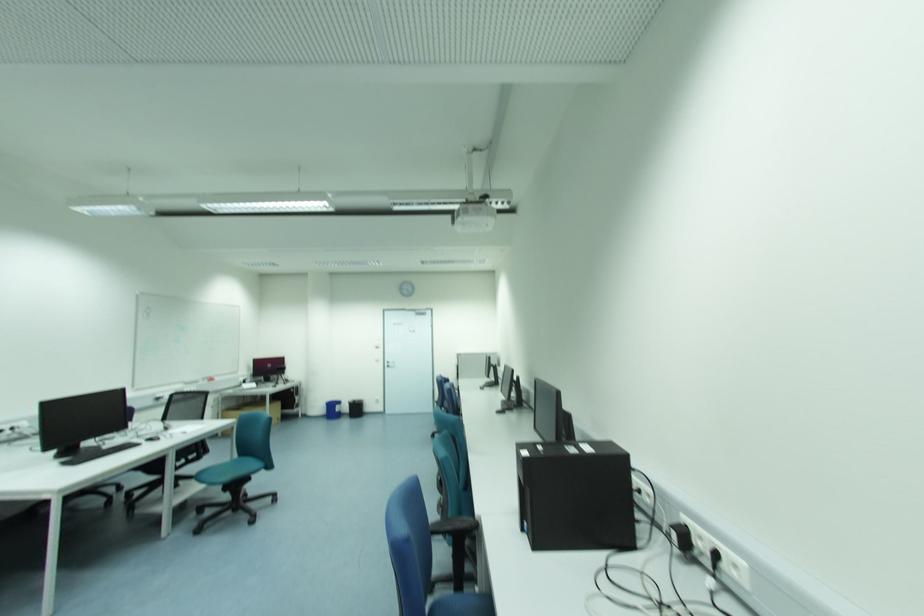
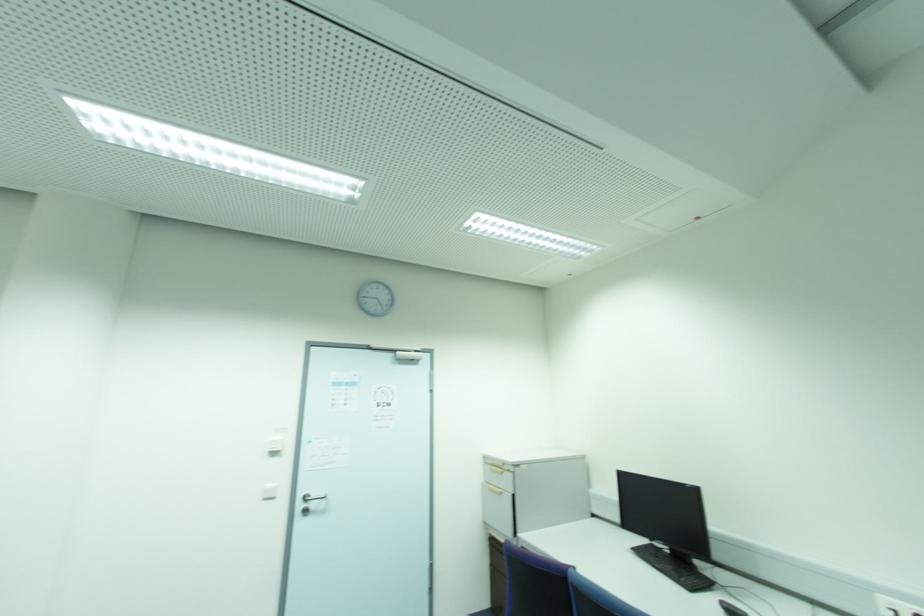
In the second image, find the point that corresponds to the point at 388,363 in the first image.

(306, 500)